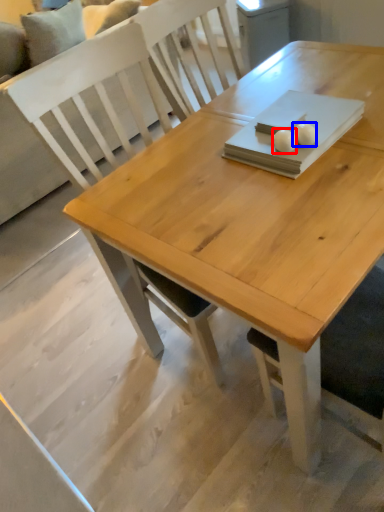
Question: Which object is closer to the camera taking this photo, food (highlighted by a red box) or food (highlighted by a blue box)?

Choices:
 (A) food
 (B) food

Answer: (A)